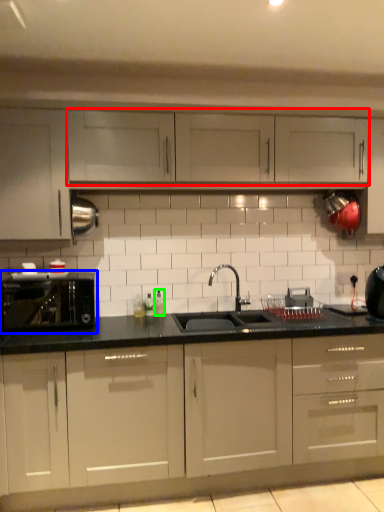
Question: Based on their relative distances, which object is farther from cabinetry (highlighted by a red box)? Choose from home appliance (highlighted by a blue box) and bottle (highlighted by a green box).

Choices:
 (A) home appliance
 (B) bottle

Answer: (A)